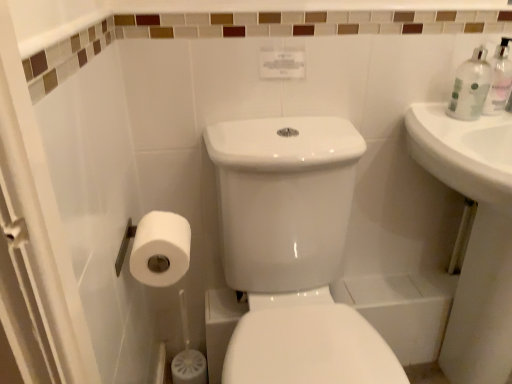
Question: Is white matte toilet paper at lower left positioned with its back to clear plastic bottle at upper right?

Choices:
 (A) no
 (B) yes

Answer: (A)

Question: Can you confirm if white matte toilet paper at lower left is shorter than clear plastic bottle at upper right?

Choices:
 (A) no
 (B) yes

Answer: (B)

Question: Considering the relative sizes of white matte toilet paper at lower left and clear plastic bottle at upper right in the image provided, is white matte toilet paper at lower left wider than clear plastic bottle at upper right?

Choices:
 (A) no
 (B) yes

Answer: (B)

Question: Is white matte toilet paper at lower left far from clear plastic bottle at upper right?

Choices:
 (A) yes
 (B) no

Answer: (B)

Question: Is white matte toilet paper at lower left positioned in front of clear plastic bottle at upper right?

Choices:
 (A) yes
 (B) no

Answer: (A)

Question: From a real-world perspective, is clear plastic bottle at upper right above or below clear plastic bottle at upper right?

Choices:
 (A) below
 (B) above

Answer: (A)

Question: Is clear plastic bottle at upper right wider or thinner than clear plastic bottle at upper right?

Choices:
 (A) thin
 (B) wide

Answer: (B)

Question: Based on their sizes in the image, would you say clear plastic bottle at upper right is bigger or smaller than clear plastic bottle at upper right?

Choices:
 (A) big
 (B) small

Answer: (A)

Question: Is point (499, 100) closer or farther from the camera than point (475, 79)?

Choices:
 (A) farther
 (B) closer

Answer: (A)

Question: From the image's perspective, relative to clear plastic bottle at upper right, is white glossy porcelain at center above or below?

Choices:
 (A) below
 (B) above

Answer: (A)

Question: Is point (281, 281) positioned closer to the camera than point (496, 48)?

Choices:
 (A) closer
 (B) farther

Answer: (B)

Question: Considering the positions of white glossy porcelain at center and clear plastic bottle at upper right in the image, is white glossy porcelain at center wider or thinner than clear plastic bottle at upper right?

Choices:
 (A) thin
 (B) wide

Answer: (B)

Question: In the image, is white glossy porcelain at center on the left side or the right side of clear plastic bottle at upper right?

Choices:
 (A) right
 (B) left

Answer: (B)

Question: In the image, is white matte toilet paper at lower left positioned in front of or behind clear plastic bottle at upper right?

Choices:
 (A) behind
 (B) front

Answer: (B)

Question: Looking at the image, does white matte toilet paper at lower left seem bigger or smaller compared to clear plastic bottle at upper right?

Choices:
 (A) small
 (B) big

Answer: (B)